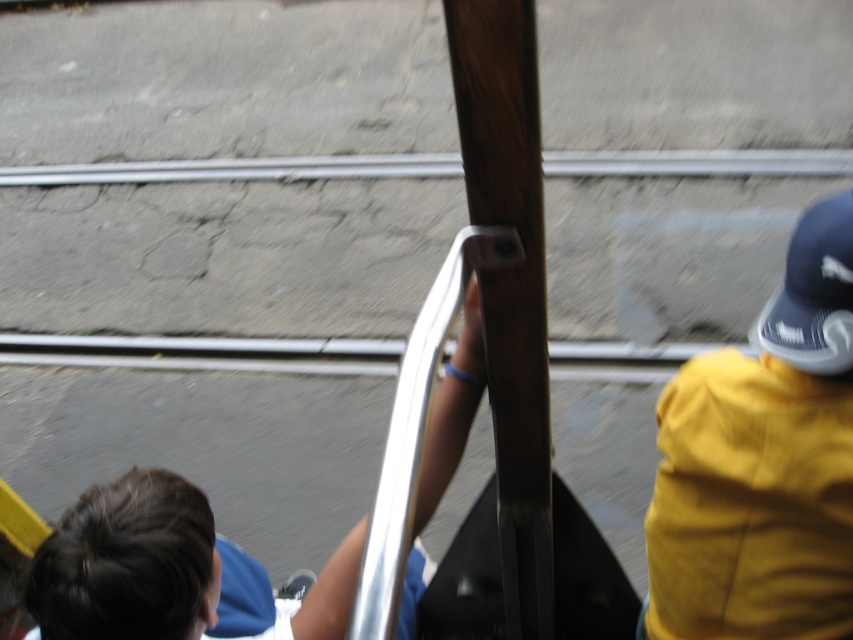
In the scene shown: You are a passenger on a tram and notice two objects in your view. The yellow fabric cap at right and the wooden pole at center. Which object appears bigger in your view?

The yellow fabric cap at right appears larger in size than the wooden pole at center.

You are sitting in the tram and want to know if the blue fabric shirt at center is nearer to you than the blue fabric baseball cap at upper right. Based on the scene, can you tell which one is closer?

The blue fabric shirt at center is closer to the viewer than the blue fabric baseball cap at upper right.